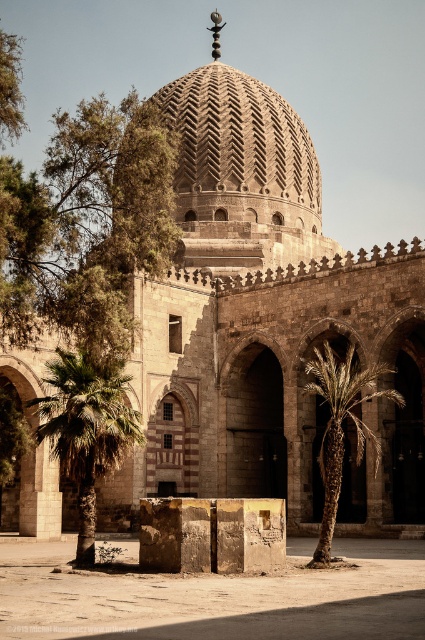
You are standing in the courtyard of the mosque and notice both the stone textured dome at center and the green leafy palm tree at center. Which object is positioned higher from the ground?

The stone textured dome at center is above the green leafy palm tree at center, so the dome is higher from the ground.

You are an architect visiting the mosque and need to determine the relative heights of the stone pillar at center and the stone textured dome at center. Which one is taller?

The stone textured dome at center is taller than the stone pillar at center.

You are a drone operator tasked with capturing aerial footage of the stone textured dome at center and the green leafy palm at lower left. The minimum distance required between the drone and the objects for clear footage is 30 meters. Can the drone safely capture both objects without violating the distance requirement?

The stone textured dome at center and green leafy palm at lower left are 36.77 meters apart from each other. Since the required minimum distance is 30 meters, the drone can safely capture both objects as the distance between them meets the requirement.